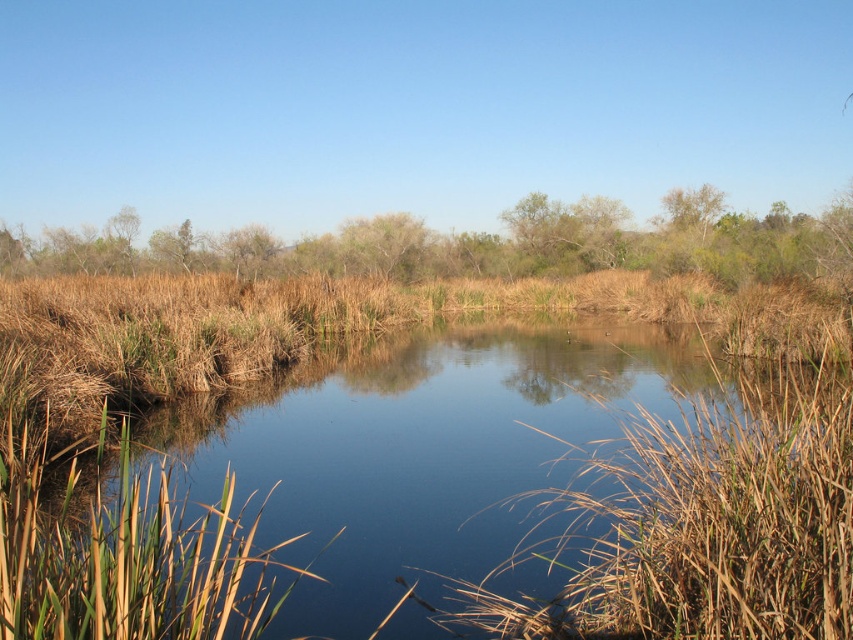
Question: Does brown grassy river at center have a larger size compared to green leafy tree at center?

Choices:
 (A) no
 (B) yes

Answer: (A)

Question: Which of the following is the farthest from the observer?

Choices:
 (A) (706, 204)
 (B) (207, 246)
 (C) (408, 244)
 (D) (311, 483)

Answer: (B)

Question: Observing the image, what is the correct spatial positioning of brown grassy river at center in reference to green leafy tree at center?

Choices:
 (A) above
 (B) below

Answer: (B)

Question: Which object is the farthest from the green leafy tree at center?

Choices:
 (A) brown grassy river at center
 (B) green leafy trees at center

Answer: (A)

Question: Can you confirm if brown grassy river at center is wider than green leafy tree at center?

Choices:
 (A) yes
 (B) no

Answer: (A)

Question: Which of the following is the farthest from the observer?

Choices:
 (A) green leafy tree at upper right
 (B) green leafy tree at center
 (C) brown grassy river at center

Answer: (B)